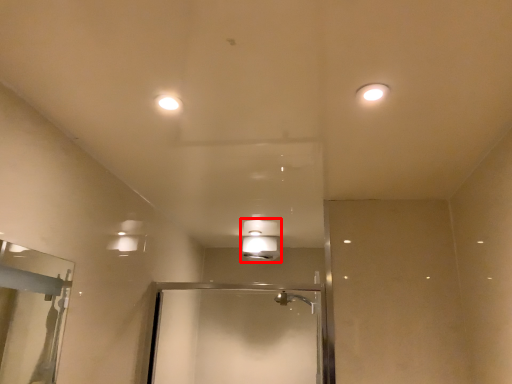
Question: From the image's perspective, what is the correct spatial relationship of light fixture (annotated by the red box) in relation to light fixture?

Choices:
 (A) above
 (B) below

Answer: (B)